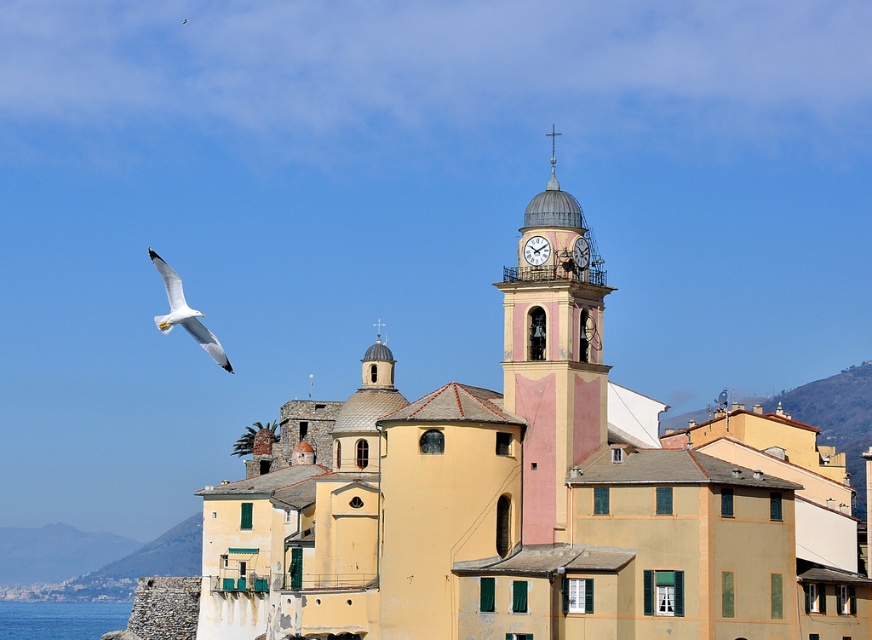
Does light yellow stucco church at center appear over blue water at lower left?

Yes.

Who is positioned more to the right, light yellow stucco church at center or blue water at lower left?

Positioned to the right is light yellow stucco church at center.

Is point (782, 506) in front of point (58, 624)?

Yes, point (782, 506) is in front of point (58, 624).

This screenshot has height=640, width=872. Find the location of `light yellow stucco church at center`. light yellow stucco church at center is located at coordinates [532, 500].

Does point (161, 332) come farther from viewer compared to point (545, 253)?

Yes, it is.

What do you see at coordinates (184, 314) in the screenshot? This screenshot has width=872, height=640. I see `white feathered bird at upper left` at bounding box center [184, 314].

Is point (230, 365) closer to camera compared to point (529, 264)?

No, (230, 365) is behind (529, 264).

Image resolution: width=872 pixels, height=640 pixels. I want to click on white feathered bird at upper left, so click(184, 314).

Is blue water at lower left closer to camera compared to white glossy clock at upper center?

No, it is behind white glossy clock at upper center.

Between blue water at lower left and white glossy clock at upper center, which one appears on the right side from the viewer's perspective?

white glossy clock at upper center

Locate an element on the screen. The width and height of the screenshot is (872, 640). blue water at lower left is located at coordinates (60, 620).